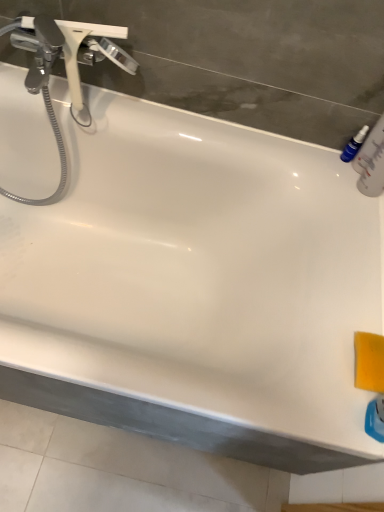
The image size is (384, 512). I want to click on free space that is to the left of blue plastic bottle at upper right, so click(296, 148).